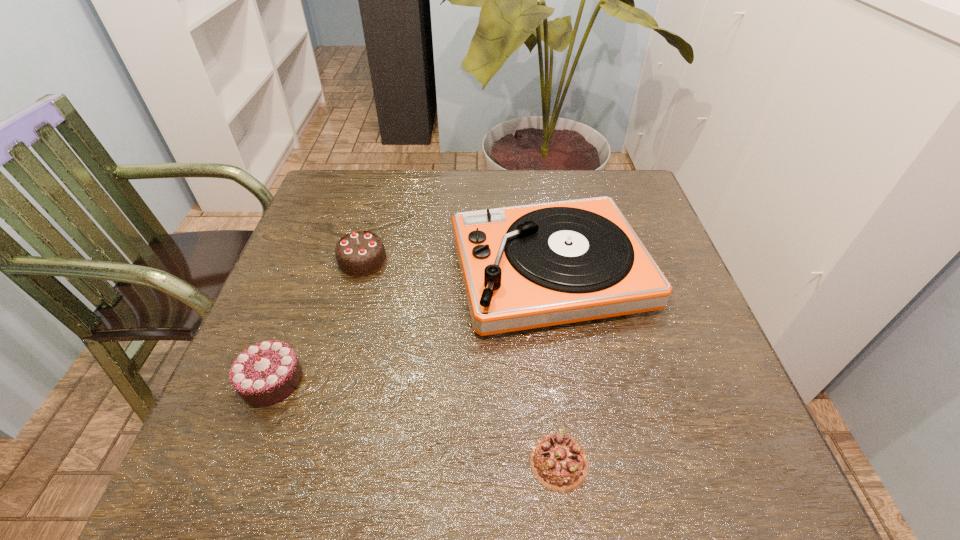
This screenshot has height=540, width=960. I want to click on object that can be found as the third closest to the rightmost chocolate cake, so click(x=361, y=253).

Locate an element on the screen. The height and width of the screenshot is (540, 960). the third closest object relative to the tallest object is located at coordinates (265, 373).

Locate an element on the screen. This screenshot has height=540, width=960. chocolate cake object that ranks as the second closest to the farthest chocolate cake is located at coordinates (559, 462).

Locate an element on the screen. Image resolution: width=960 pixels, height=540 pixels. chocolate cake that is the closest to the tallest object is located at coordinates (361, 253).

Where is `vacant region that satisfies the following two spatial constraints: 1. on the front side of the record player; 2. on the right side of the farthest chocolate cake`? vacant region that satisfies the following two spatial constraints: 1. on the front side of the record player; 2. on the right side of the farthest chocolate cake is located at coordinates (360, 271).

Identify the location of free space that satisfies the following two spatial constraints: 1. on the back side of the tallest object; 2. on the left side of the second nearest object. (313, 271).

This screenshot has height=540, width=960. What are the coordinates of `free region that satisfies the following two spatial constraints: 1. on the front side of the farthest chocolate cake; 2. on the left side of the shortest chocolate cake` in the screenshot? It's located at (307, 462).